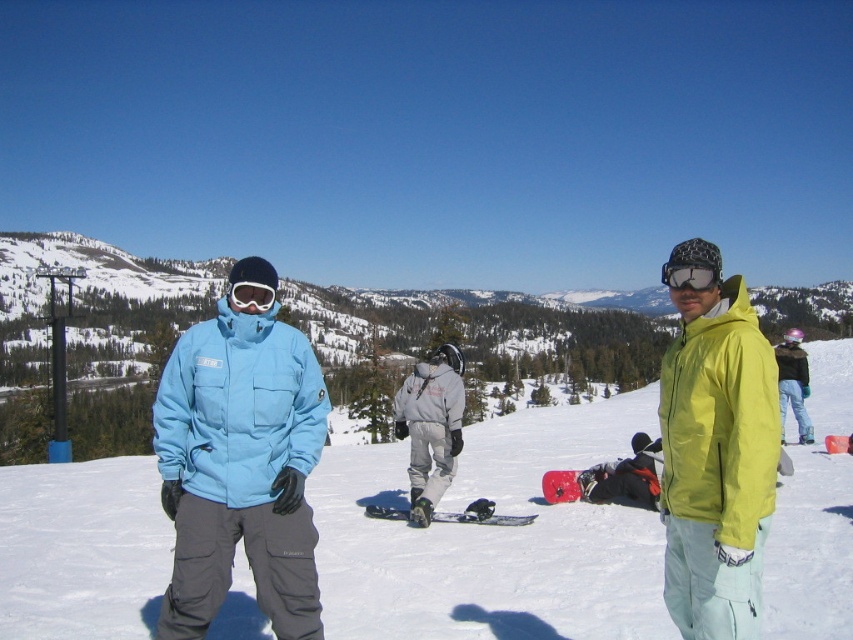
Is matte yellow jacket at right to the right of gray matte snowboard at center from the viewer's perspective?

Indeed, matte yellow jacket at right is positioned on the right side of gray matte snowboard at center.

This screenshot has width=853, height=640. Describe the element at coordinates (717, 461) in the screenshot. I see `matte yellow jacket at right` at that location.

Which is in front, point (738, 461) or point (448, 456)?

Point (738, 461) is more forward.

Identify the location of matte yellow jacket at right. (717, 461).

Does point (753, 564) come closer to viewer compared to point (558, 486)?

Yes.

I want to click on matte yellow jacket at right, so click(717, 461).

This screenshot has width=853, height=640. Identify the location of matte yellow jacket at right. (717, 461).

Does gray matte snowboard at center appear under white matte goggles at upper center?

Indeed, gray matte snowboard at center is positioned under white matte goggles at upper center.

Is point (427, 452) positioned in front of point (268, 285)?

No.

In order to click on gray matte snowboard at center in this screenshot , I will do `click(430, 428)`.